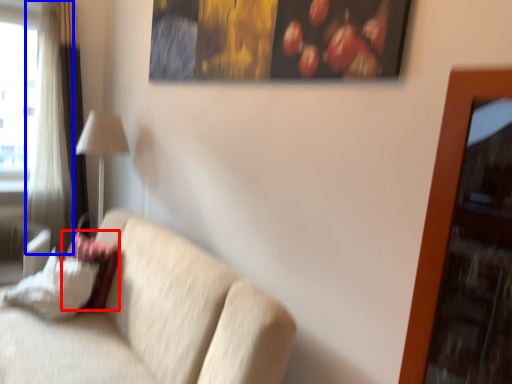
Question: Which of the following is the farthest to the observer, pillow (highlighted by a red box) or curtain (highlighted by a blue box)?

Choices:
 (A) pillow
 (B) curtain

Answer: (B)